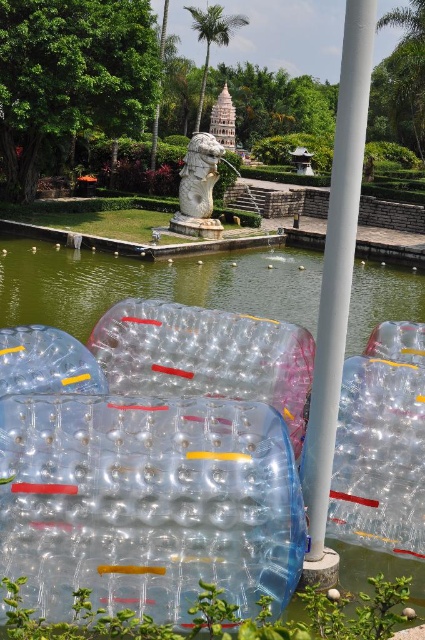
You are planning to place a new bench in the park. The bench is 1.5 meters long. You want to place it between the transparent plastic water at center and the white smooth pole at center. Can the bench fit in the space between them?

The transparent plastic water at center has a larger size compared to white smooth pole at center. However, without knowing the exact distance between them, it is impossible to determine if the bench will fit. Please provide more information about the spacing between the two objects.